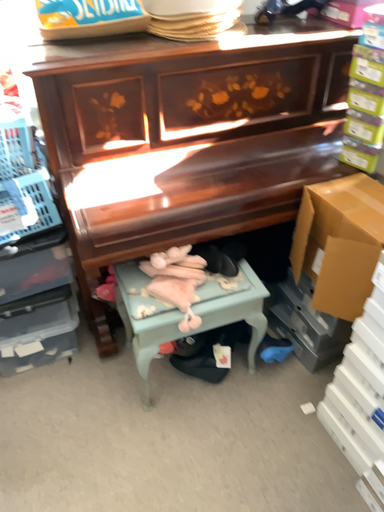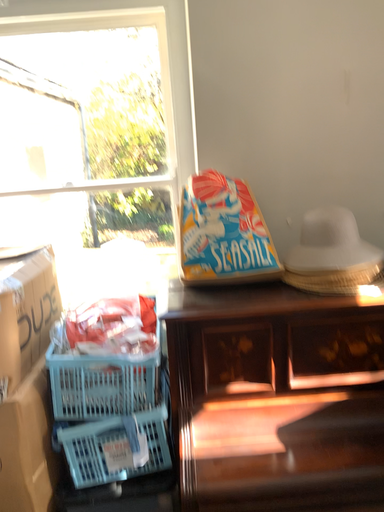
Question: How did the camera likely rotate when shooting the video?

Choices:
 (A) rotated left
 (B) rotated right

Answer: (A)